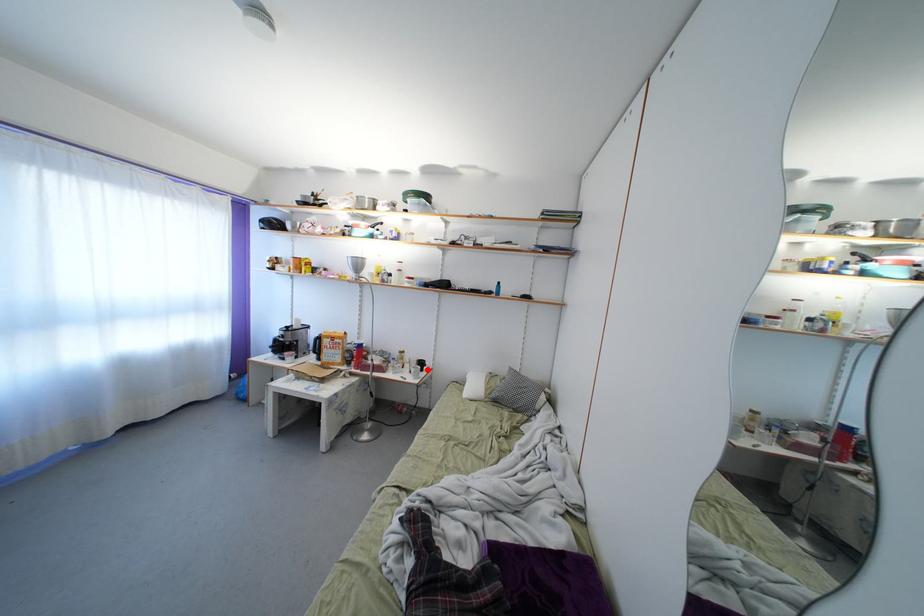
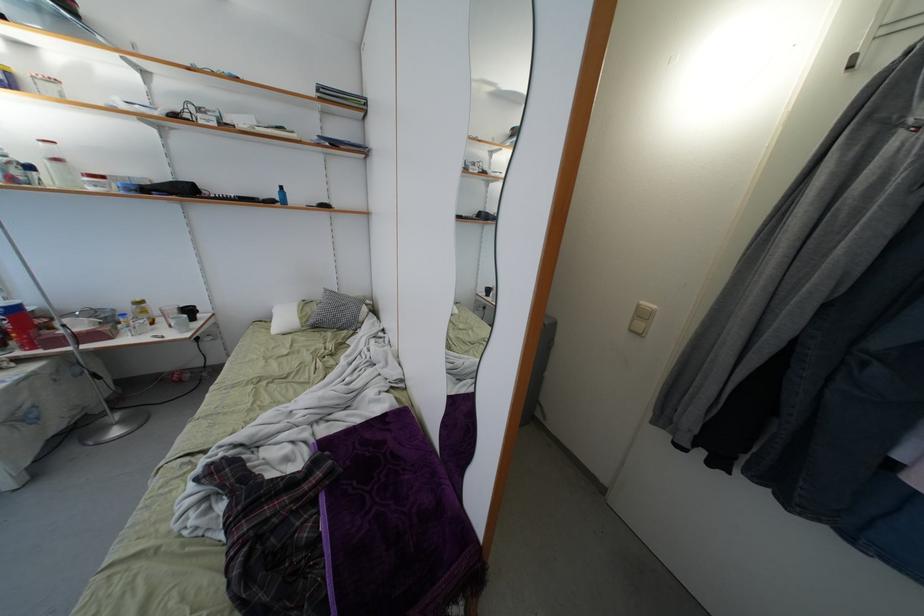
Question: I am providing you with two images of the same scene from different viewpoints. A red point is shown in image1. For the corresponding object point in image2, is it positioned nearer or farther from the camera?

Choices:
 (A) Nearer
 (B) Farther

Answer: (A)